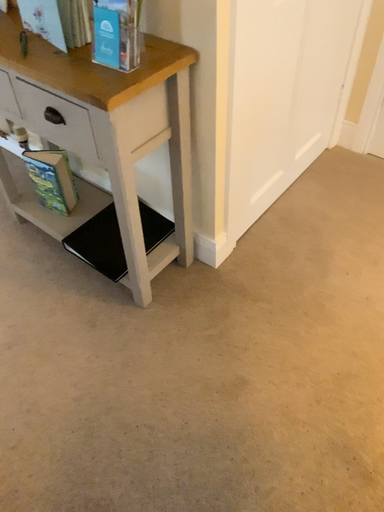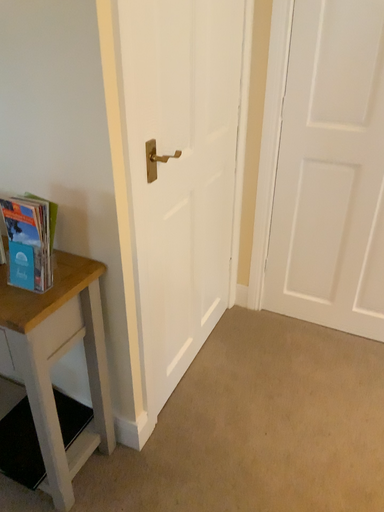
Question: How did the camera likely rotate when shooting the video?

Choices:
 (A) rotated right
 (B) rotated left

Answer: (A)